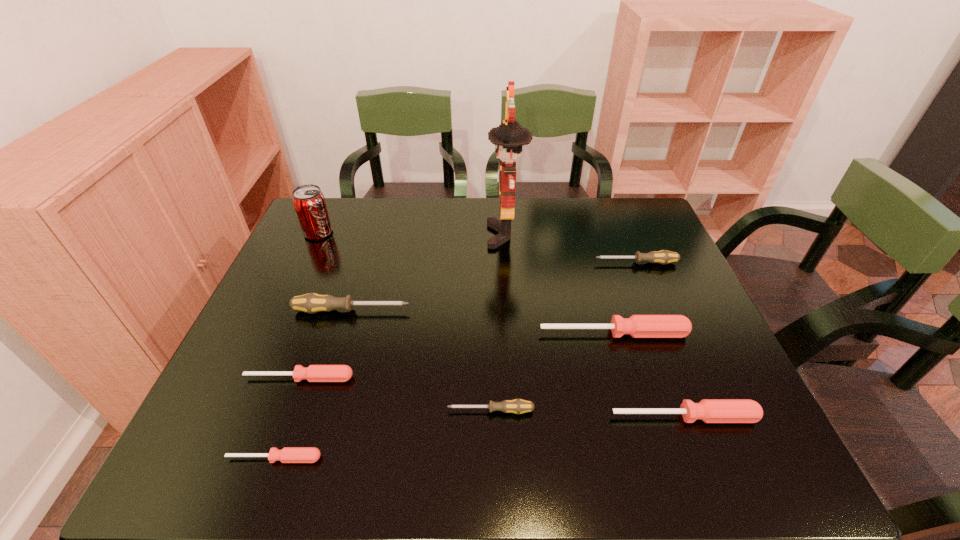
This screenshot has width=960, height=540. What are the coordinates of `nutcracker` in the screenshot? It's located at (509, 137).

This screenshot has height=540, width=960. Find the location of `pop soda`. pop soda is located at coordinates (308, 200).

Locate an element on the screen. This screenshot has width=960, height=540. red pop soda is located at coordinates (308, 200).

Locate an element on the screen. This screenshot has width=960, height=540. the biggest gray screwdriver is located at coordinates (311, 303).

What are the coordinates of `the sixth nearest screwdriver` in the screenshot? It's located at (311, 303).

The width and height of the screenshot is (960, 540). Find the location of `the fifth nearest screwdriver`. the fifth nearest screwdriver is located at coordinates (638, 326).

Where is `the fifth nearest object`? the fifth nearest object is located at coordinates (638, 326).

Where is `the farthest gray screwdriver`? This screenshot has width=960, height=540. the farthest gray screwdriver is located at coordinates (663, 257).

Identify the location of the rightmost gray screwdriver. (663, 257).

You are a GUI agent. You are given a task and a screenshot of the screen. Output one action in this format:
    pyautogui.click(x=<x>, y=<y>)
    Task: Click on the second biggest red screwdriver
    This screenshot has width=960, height=540.
    Given the screenshot: What is the action you would take?
    pyautogui.click(x=708, y=410)